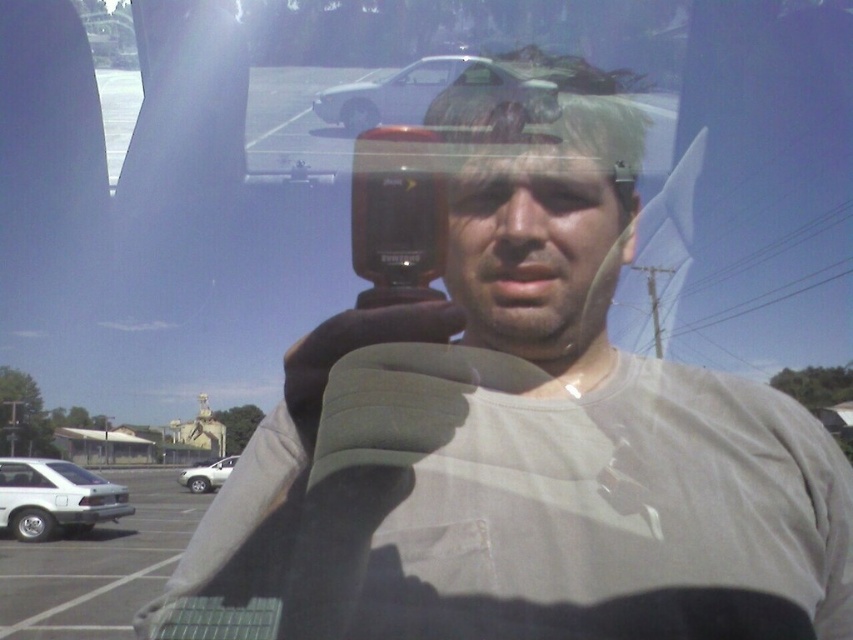
Does white matte car at lower left have a lesser height compared to silver metallic car at upper center?

Correct, white matte car at lower left is not as tall as silver metallic car at upper center.

Is point (120, 536) in front of point (436, 86)?

No, (120, 536) is further to viewer.

At what (x,y) coordinates should I click in order to perform the action: click on white matte car at lower left. Please return your answer as a coordinate pair (x, y). This screenshot has width=853, height=640. Looking at the image, I should click on (97, 564).

The image size is (853, 640). I want to click on white matte car at lower left, so click(97, 564).

Image resolution: width=853 pixels, height=640 pixels. Find the location of `white matte car at lower left`. white matte car at lower left is located at coordinates (97, 564).

Is point (71, 556) positioned in front of point (180, 483)?

Yes, point (71, 556) is in front of point (180, 483).

The height and width of the screenshot is (640, 853). What are the coordinates of `white matte car at lower left` in the screenshot? It's located at (97, 564).

Can you confirm if silver metallic sedan at lower left is taller than silver metallic suv at lower left?

Yes, silver metallic sedan at lower left is taller than silver metallic suv at lower left.

Is the position of silver metallic sedan at lower left less distant than that of silver metallic suv at lower left?

Yes, silver metallic sedan at lower left is in front of silver metallic suv at lower left.

Locate an element on the screen. silver metallic sedan at lower left is located at coordinates (55, 497).